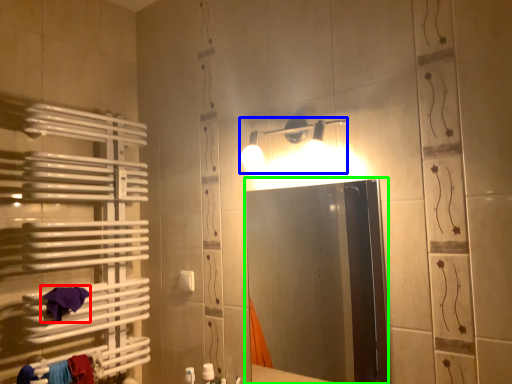
Question: Which object is positioned closest to bath towel (highlighted by a red box)? Select from light fixture (highlighted by a blue box) and mirror (highlighted by a green box).

Choices:
 (A) light fixture
 (B) mirror

Answer: (A)